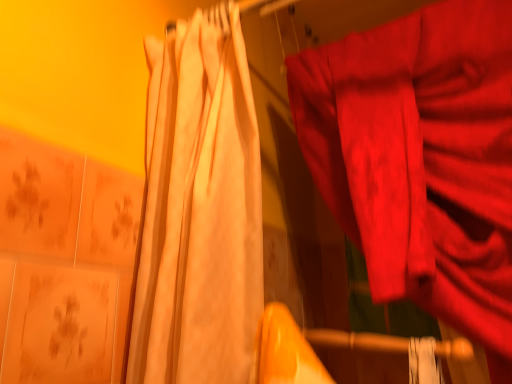
The image size is (512, 384). What are the coordinates of `matte white curtain at left, which is the 1th curtain from left to right` in the screenshot? It's located at (199, 213).

This screenshot has width=512, height=384. Describe the element at coordinates (199, 213) in the screenshot. I see `matte white curtain at left, the 2th curtain when ordered from right to left` at that location.

What do you see at coordinates (421, 159) in the screenshot? Image resolution: width=512 pixels, height=384 pixels. I see `matte red fabric at right, arranged as the second curtain when viewed from the left` at bounding box center [421, 159].

Identify the location of matte red fabric at right, positioned as the 1th curtain in right-to-left order. Image resolution: width=512 pixels, height=384 pixels. (421, 159).

At what (x,y) coordinates should I click in order to perform the action: click on matte white curtain at left, the 2th curtain when ordered from right to left. Please return your answer as a coordinate pair (x, y). Looking at the image, I should click on (199, 213).

Considering the positions of objects matte red fabric at right, arranged as the second curtain when viewed from the left, and matte white curtain at left, the 2th curtain when ordered from right to left, in the image provided, who is more to the right, matte red fabric at right, arranged as the second curtain when viewed from the left, or matte white curtain at left, the 2th curtain when ordered from right to left,?

Answer: Positioned to the right is matte red fabric at right, arranged as the second curtain when viewed from the left.

In the image, is matte red fabric at right, arranged as the second curtain when viewed from the left, positioned in front of or behind matte white curtain at left, which is the 1th curtain from left to right?

Clearly, matte red fabric at right, arranged as the second curtain when viewed from the left, is behind matte white curtain at left, which is the 1th curtain from left to right.

Does point (308, 131) appear closer or farther from the camera than point (248, 80)?

Clearly, point (308, 131) is more distant from the camera than point (248, 80).

From the image's perspective, which is above, matte red fabric at right, positioned as the 1th curtain in right-to-left order, or matte white curtain at left, which is the 1th curtain from left to right?

matte white curtain at left, which is the 1th curtain from left to right, is shown above in the image.

From a real-world perspective, is matte red fabric at right, positioned as the 1th curtain in right-to-left order, positioned under matte white curtain at left, the 2th curtain when ordered from right to left, based on gravity?

Actually, matte red fabric at right, positioned as the 1th curtain in right-to-left order, is physically above matte white curtain at left, the 2th curtain when ordered from right to left, in the real world.

Does matte red fabric at right, arranged as the second curtain when viewed from the left, have a greater width compared to matte white curtain at left, which is the 1th curtain from left to right?

In fact, matte red fabric at right, arranged as the second curtain when viewed from the left, might be narrower than matte white curtain at left, which is the 1th curtain from left to right.

Who is taller, matte red fabric at right, arranged as the second curtain when viewed from the left, or matte white curtain at left, which is the 1th curtain from left to right?

matte red fabric at right, arranged as the second curtain when viewed from the left.

From the picture: Who is smaller, matte red fabric at right, positioned as the 1th curtain in right-to-left order, or matte white curtain at left, the 2th curtain when ordered from right to left?

matte white curtain at left, the 2th curtain when ordered from right to left, is smaller.

Could matte white curtain at left, which is the 1th curtain from left to right, be considered to be inside matte red fabric at right, positioned as the 1th curtain in right-to-left order?

Actually, matte white curtain at left, which is the 1th curtain from left to right, is outside matte red fabric at right, positioned as the 1th curtain in right-to-left order.

In the scene shown: Is matte red fabric at right, positioned as the 1th curtain in right-to-left order, positioned far away from matte white curtain at left, which is the 1th curtain from left to right?

No, matte red fabric at right, positioned as the 1th curtain in right-to-left order, is in close proximity to matte white curtain at left, which is the 1th curtain from left to right.

Is matte red fabric at right, positioned as the 1th curtain in right-to-left order, aimed at matte white curtain at left, which is the 1th curtain from left to right?

Yes, matte red fabric at right, positioned as the 1th curtain in right-to-left order, is turned towards matte white curtain at left, which is the 1th curtain from left to right.

What's the angular difference between matte red fabric at right, arranged as the second curtain when viewed from the left, and matte white curtain at left, which is the 1th curtain from left to right,'s facing directions?

2.8 degrees.

The image size is (512, 384). What are the coordinates of `curtain on the left of matte red fabric at right, arranged as the second curtain when viewed from the left` in the screenshot? It's located at (199, 213).

Which is more to the right, matte white curtain at left, which is the 1th curtain from left to right, or matte red fabric at right, positioned as the 1th curtain in right-to-left order?

From the viewer's perspective, matte red fabric at right, positioned as the 1th curtain in right-to-left order, appears more on the right side.

Is matte white curtain at left, which is the 1th curtain from left to right, in front of or behind matte red fabric at right, positioned as the 1th curtain in right-to-left order, in the image?

Visually, matte white curtain at left, which is the 1th curtain from left to right, is located in front of matte red fabric at right, positioned as the 1th curtain in right-to-left order.

Which point is more distant from viewer, (197, 105) or (467, 53)?

Positioned behind is point (467, 53).

From the picture: From the image's perspective, is matte white curtain at left, the 2th curtain when ordered from right to left, above or below matte red fabric at right, positioned as the 1th curtain in right-to-left order?

matte white curtain at left, the 2th curtain when ordered from right to left, is situated higher than matte red fabric at right, positioned as the 1th curtain in right-to-left order, in the image.

From a real-world perspective, is matte white curtain at left, which is the 1th curtain from left to right, on matte red fabric at right, positioned as the 1th curtain in right-to-left order?

Actually, matte white curtain at left, which is the 1th curtain from left to right, is physically below matte red fabric at right, positioned as the 1th curtain in right-to-left order, in the real world.

Which of these two, matte white curtain at left, which is the 1th curtain from left to right, or matte red fabric at right, arranged as the second curtain when viewed from the left, is thinner?

Thinner between the two is matte red fabric at right, arranged as the second curtain when viewed from the left.

Is matte white curtain at left, the 2th curtain when ordered from right to left, taller than matte red fabric at right, positioned as the 1th curtain in right-to-left order?

Incorrect, the height of matte white curtain at left, the 2th curtain when ordered from right to left, is not larger of that of matte red fabric at right, positioned as the 1th curtain in right-to-left order.

Considering the relative sizes of matte white curtain at left, which is the 1th curtain from left to right, and matte red fabric at right, arranged as the second curtain when viewed from the left, in the image provided, is matte white curtain at left, which is the 1th curtain from left to right, smaller than matte red fabric at right, arranged as the second curtain when viewed from the left,?

Yes, matte white curtain at left, which is the 1th curtain from left to right, is smaller than matte red fabric at right, arranged as the second curtain when viewed from the left.

Choose the correct answer: Is matte white curtain at left, the 2th curtain when ordered from right to left, inside matte red fabric at right, arranged as the second curtain when viewed from the left, or outside it?

matte white curtain at left, the 2th curtain when ordered from right to left, exists outside the volume of matte red fabric at right, arranged as the second curtain when viewed from the left.

Is matte white curtain at left, which is the 1th curtain from left to right, not near matte red fabric at right, positioned as the 1th curtain in right-to-left order?

No, matte white curtain at left, which is the 1th curtain from left to right, is not far from matte red fabric at right, positioned as the 1th curtain in right-to-left order.

Is matte white curtain at left, which is the 1th curtain from left to right, positioned with its back to matte red fabric at right, arranged as the second curtain when viewed from the left?

Yes, matte white curtain at left, which is the 1th curtain from left to right, is facing away from matte red fabric at right, arranged as the second curtain when viewed from the left.

You are a GUI agent. You are given a task and a screenshot of the screen. Output one action in this format:
    pyautogui.click(x=<x>, y=<y>)
    Task: Click on the curtain that is on the right side of matte white curtain at left, the 2th curtain when ordered from right to left
    This screenshot has height=384, width=512.
    Given the screenshot: What is the action you would take?
    pyautogui.click(x=421, y=159)

In the image, there is a matte red fabric at right, positioned as the 1th curtain in right-to-left order. In order to click on curtain above it (from the image's perspective) in this screenshot , I will do `click(199, 213)`.

Locate an element on the screen. curtain below the matte red fabric at right, positioned as the 1th curtain in right-to-left order (from a real-world perspective) is located at coordinates (199, 213).